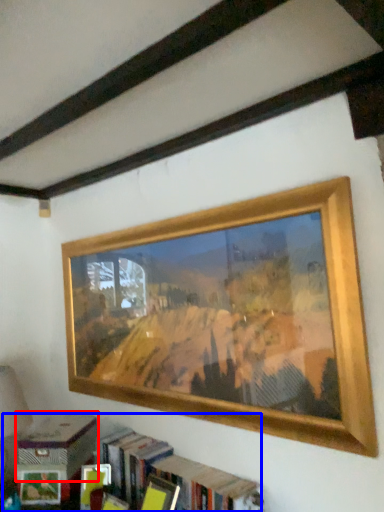
Question: Among these objects, which one is nearest to the camera, paperback book (highlighted by a red box) or bookcase (highlighted by a blue box)?

Choices:
 (A) paperback book
 (B) bookcase

Answer: (B)